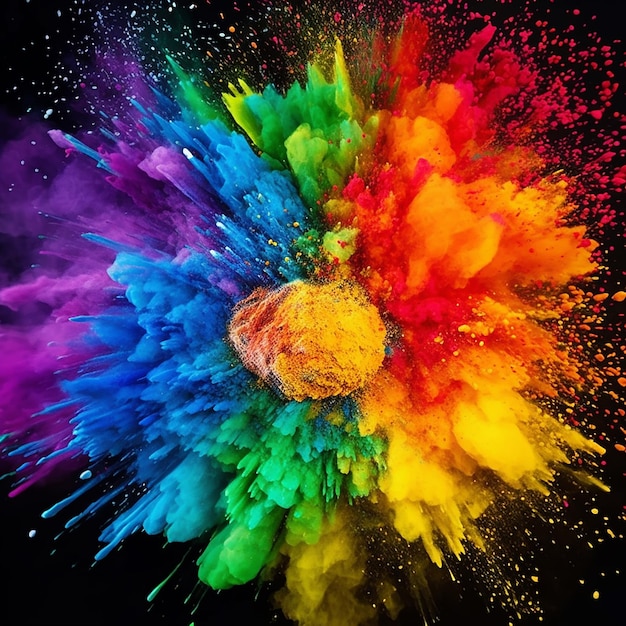
At what (x,y) coordinates should I click in order to perform the action: click on empty space at top right corner. Please return your answer as a coordinate pair (x, y). The height and width of the screenshot is (626, 626). Looking at the image, I should click on (618, 2).